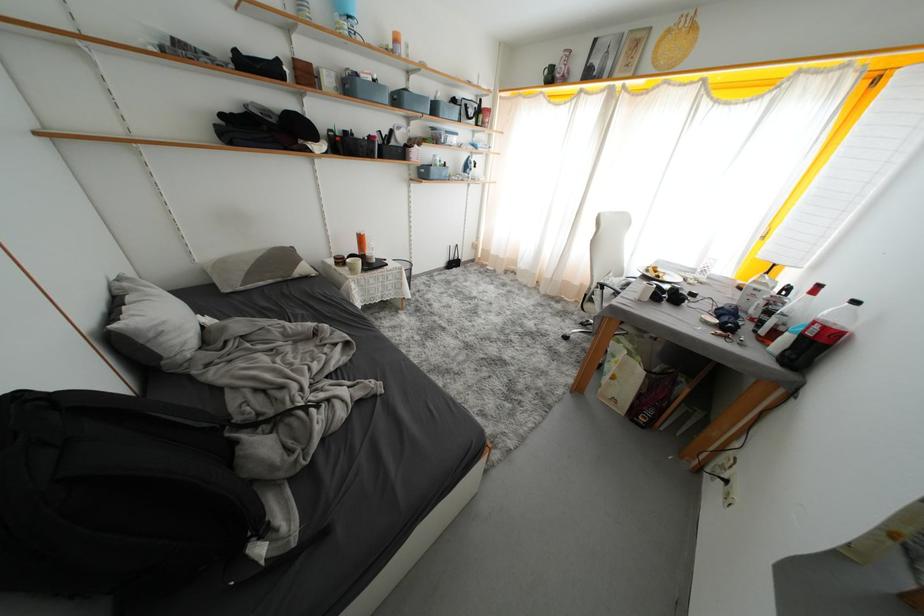
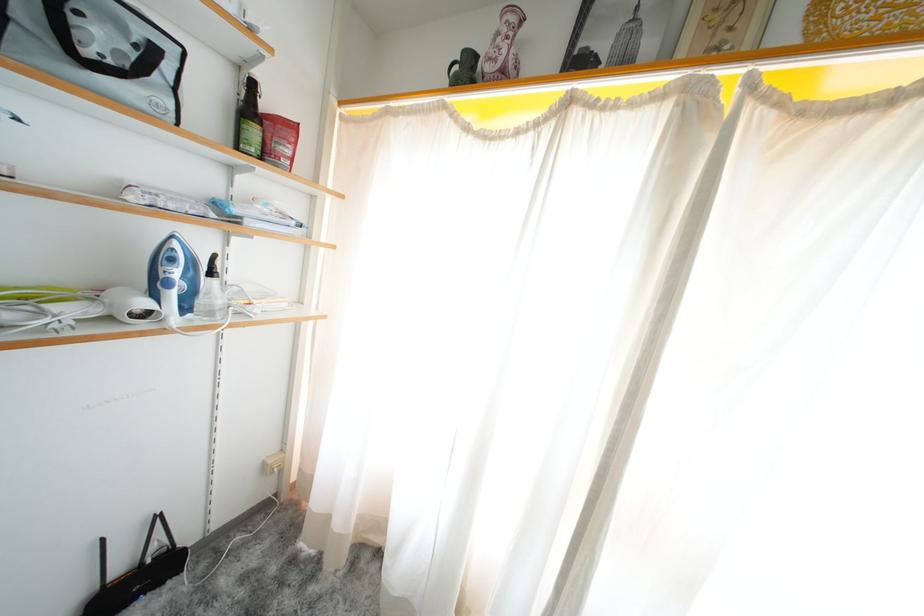
Find the pixel in the second image that matches point (459, 267) in the first image.

(143, 586)